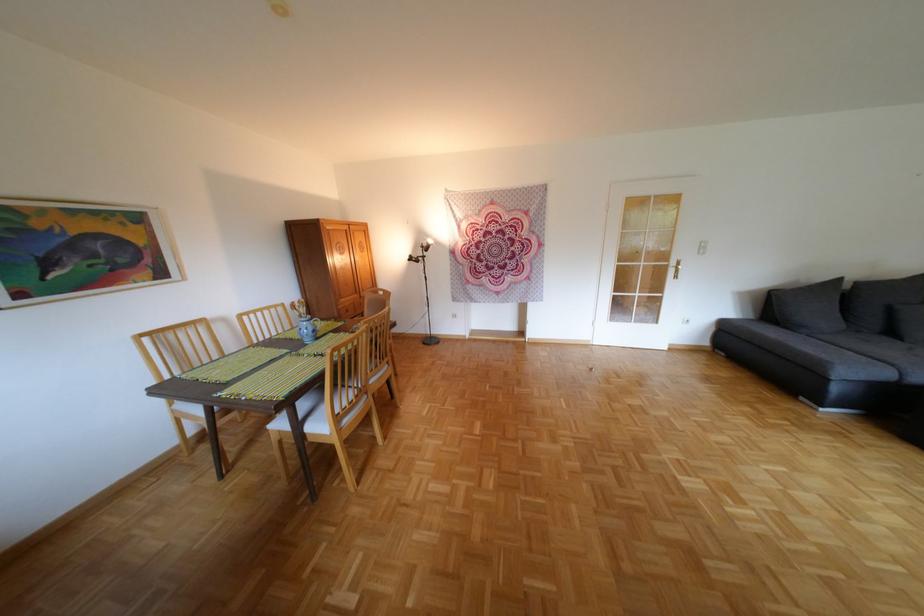
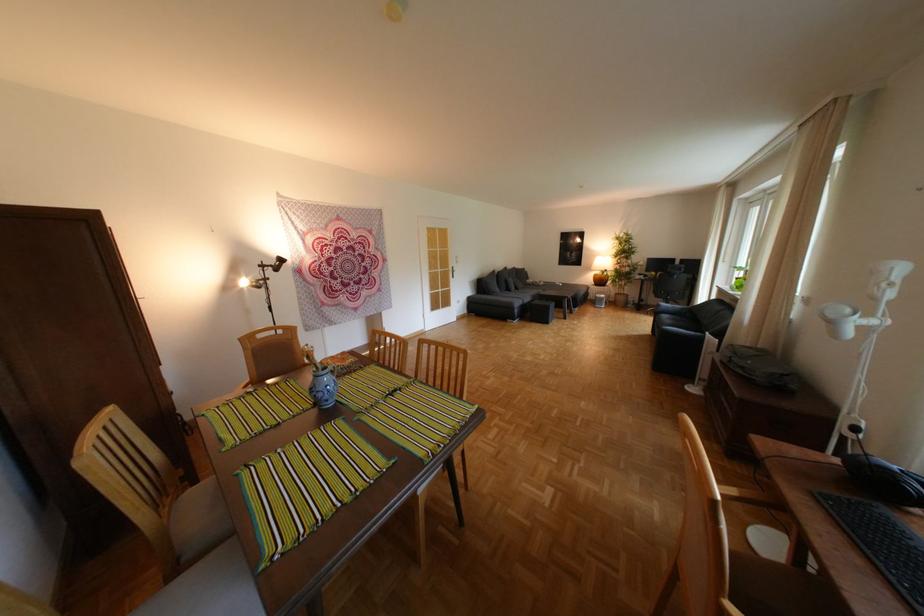
In the second image, find the point that corresponds to pixel 654 264 in the first image.

(453, 270)